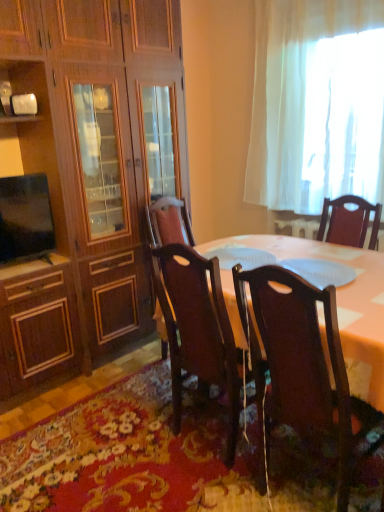
The height and width of the screenshot is (512, 384). What do you see at coordinates (197, 329) in the screenshot?
I see `polished dark wood chair at center, the 1th chair viewed from the left` at bounding box center [197, 329].

The image size is (384, 512). Describe the element at coordinates (25, 218) in the screenshot. I see `matte black tv at left` at that location.

What do you see at coordinates (317, 104) in the screenshot? Image resolution: width=384 pixels, height=512 pixels. I see `white sheer curtain at upper right` at bounding box center [317, 104].

The height and width of the screenshot is (512, 384). Describe the element at coordinates (304, 367) in the screenshot. I see `dark wood chair at lower right, arranged as the 1th chair when viewed from the right` at that location.

Locate an element on the screen. This screenshot has height=512, width=384. polished dark wood chair at center, the 2th chair in the right-to-left sequence is located at coordinates (197, 329).

Considering the relative sizes of matte black tv at left and polished dark wood chair at center, the 2th chair in the right-to-left sequence, in the image provided, is matte black tv at left thinner than polished dark wood chair at center, the 2th chair in the right-to-left sequence,?

Correct, the width of matte black tv at left is less than that of polished dark wood chair at center, the 2th chair in the right-to-left sequence.

From the picture: Who is smaller, matte black tv at left or polished dark wood chair at center, the 2th chair in the right-to-left sequence?

matte black tv at left.

Between matte black tv at left and polished dark wood chair at center, the 1th chair viewed from the left, which one is positioned in front?

polished dark wood chair at center, the 1th chair viewed from the left, is more forward.

Looking at this image, how many degrees apart are the facing directions of matte black tv at left and polished dark wood chair at center, the 2th chair in the right-to-left sequence?

There is a 93.4-degree angle between the facing directions of matte black tv at left and polished dark wood chair at center, the 2th chair in the right-to-left sequence.

From the image's perspective, is white sheer curtain at upper right located above or below dark wood chair at lower right, arranged as the 1th chair when viewed from the right?

From the image's perspective, white sheer curtain at upper right appears above dark wood chair at lower right, arranged as the 1th chair when viewed from the right.

Is white sheer curtain at upper right positioned beyond the bounds of dark wood chair at lower right, the second chair positioned from the left?

Indeed, white sheer curtain at upper right is completely outside dark wood chair at lower right, the second chair positioned from the left.

Considering the relative sizes of white sheer curtain at upper right and dark wood chair at lower right, arranged as the 1th chair when viewed from the right, in the image provided, is white sheer curtain at upper right taller than dark wood chair at lower right, arranged as the 1th chair when viewed from the right,?

Correct, white sheer curtain at upper right is much taller as dark wood chair at lower right, arranged as the 1th chair when viewed from the right.

Considering the sizes of objects floral carpet at lower center and white sheer curtain at upper right in the image provided, who is bigger, floral carpet at lower center or white sheer curtain at upper right?

Bigger between the two is white sheer curtain at upper right.

Is floral carpet at lower center taller than white sheer curtain at upper right?

No, floral carpet at lower center is not taller than white sheer curtain at upper right.

Which object is more forward, floral carpet at lower center or white sheer curtain at upper right?

floral carpet at lower center.

Would you say floral carpet at lower center is to the left or to the right of white sheer curtain at upper right in the picture?

floral carpet at lower center is positioned on white sheer curtain at upper right's left side.

The height and width of the screenshot is (512, 384). Identify the location of cabinetry lying behind the polished dark wood chair at center, the 1th chair viewed from the left. (89, 173).

Is wooden cabinet at left wider than polished dark wood chair at center, the 1th chair viewed from the left?

Indeed, wooden cabinet at left has a greater width compared to polished dark wood chair at center, the 1th chair viewed from the left.

Which object is positioned more to the right, wooden cabinet at left or polished dark wood chair at center, the 1th chair viewed from the left?

From the viewer's perspective, polished dark wood chair at center, the 1th chair viewed from the left, appears more on the right side.

What's the angular difference between wooden cabinet at left and polished dark wood chair at center, the 2th chair in the right-to-left sequence,'s facing directions?

Result: 90 degrees separate the facing orientations of wooden cabinet at left and polished dark wood chair at center, the 2th chair in the right-to-left sequence.

Is point (256, 126) more distant than point (168, 333)?

That is True.

Is white sheer curtain at upper right behind polished dark wood chair at center, the 1th chair viewed from the left?

That is True.

Based on the photo, from the image's perspective, is white sheer curtain at upper right under polished dark wood chair at center, the 1th chair viewed from the left?

No.

Looking at this image, how many degrees apart are the facing directions of white sheer curtain at upper right and polished dark wood chair at center, the 1th chair viewed from the left?

The angular difference between white sheer curtain at upper right and polished dark wood chair at center, the 1th chair viewed from the left, is 180 degrees.

Identify the location of the 1st chair counting from the right of the floral carpet at lower center. (197, 329).

Considering the relative positions of floral carpet at lower center and polished dark wood chair at center, the 1th chair viewed from the left, in the image provided, is floral carpet at lower center to the left of polished dark wood chair at center, the 1th chair viewed from the left, from the viewer's perspective?

Yes, floral carpet at lower center is to the left of polished dark wood chair at center, the 1th chair viewed from the left.

Considering the sizes of floral carpet at lower center and polished dark wood chair at center, the 2th chair in the right-to-left sequence, in the image, is floral carpet at lower center taller or shorter than polished dark wood chair at center, the 2th chair in the right-to-left sequence,?

Considering their sizes, floral carpet at lower center has less height than polished dark wood chair at center, the 2th chair in the right-to-left sequence.

Considering the relative sizes of floral carpet at lower center and polished dark wood chair at center, the 2th chair in the right-to-left sequence, in the image provided, is floral carpet at lower center smaller than polished dark wood chair at center, the 2th chair in the right-to-left sequence,?

Yes.

Is dark wood chair at lower right, arranged as the 1th chair when viewed from the right, aimed at matte black tv at left?

No, dark wood chair at lower right, arranged as the 1th chair when viewed from the right, does not turn towards matte black tv at left.

Relative to matte black tv at left, is dark wood chair at lower right, the second chair positioned from the left, in front or behind?

In the image, dark wood chair at lower right, the second chair positioned from the left, appears in front of matte black tv at left.

From the image's perspective, which is above, dark wood chair at lower right, the second chair positioned from the left, or matte black tv at left?

matte black tv at left is shown above in the image.

The height and width of the screenshot is (512, 384). What are the coordinates of `television above the polished dark wood chair at center, the 1th chair viewed from the left (from a real-world perspective)` in the screenshot? It's located at 25,218.

Identify the location of curtain that is above the dark wood chair at lower right, the second chair positioned from the left (from the image's perspective). The height and width of the screenshot is (512, 384). (317, 104).

Considering their positions, is matte black tv at left positioned further to white sheer curtain at upper right than dark wood chair at lower right, the second chair positioned from the left?

Among the two, matte black tv at left is located further to white sheer curtain at upper right.

Based on their spatial positions, is wooden cabinet at left or floral carpet at lower center further from dark wood chair at lower right, arranged as the 1th chair when viewed from the right?

wooden cabinet at left lies further to dark wood chair at lower right, arranged as the 1th chair when viewed from the right, than the other object.

From the image, which object appears to be farther from white sheer curtain at upper right, wooden cabinet at left or dark wood chair at lower right, arranged as the 1th chair when viewed from the right?

Among the two, dark wood chair at lower right, arranged as the 1th chair when viewed from the right, is located further to white sheer curtain at upper right.

From the image, which object appears to be nearer to polished dark wood chair at center, the 1th chair viewed from the left, white sheer curtain at upper right or dark wood chair at lower right, arranged as the 1th chair when viewed from the right?

The object closer to polished dark wood chair at center, the 1th chair viewed from the left, is dark wood chair at lower right, arranged as the 1th chair when viewed from the right.

Which object lies further to the anchor point dark wood chair at lower right, arranged as the 1th chair when viewed from the right, white sheer curtain at upper right or floral carpet at lower center?

white sheer curtain at upper right is further to dark wood chair at lower right, arranged as the 1th chair when viewed from the right.

Looking at the image, which one is located further to polished dark wood chair at center, the 2th chair in the right-to-left sequence, wooden cabinet at left or dark wood chair at lower right, arranged as the 1th chair when viewed from the right?

wooden cabinet at left is positioned further to the anchor polished dark wood chair at center, the 2th chair in the right-to-left sequence.

Which object lies nearer to the anchor point wooden cabinet at left, white sheer curtain at upper right or dark wood chair at lower right, the second chair positioned from the left?

The object closer to wooden cabinet at left is white sheer curtain at upper right.

When comparing their distances from polished dark wood chair at center, the 2th chair in the right-to-left sequence, does floral carpet at lower center or white sheer curtain at upper right seem closer?

The object closer to polished dark wood chair at center, the 2th chair in the right-to-left sequence, is floral carpet at lower center.

Where is `chair situated between floral carpet at lower center and dark wood chair at lower right, arranged as the 1th chair when viewed from the right, from left to right`? The width and height of the screenshot is (384, 512). chair situated between floral carpet at lower center and dark wood chair at lower right, arranged as the 1th chair when viewed from the right, from left to right is located at coordinates (197, 329).

I want to click on chair located between wooden cabinet at left and dark wood chair at lower right, arranged as the 1th chair when viewed from the right, in the left-right direction, so click(x=197, y=329).

Find the location of `cabinetry that lies between white sheer curtain at upper right and floral carpet at lower center from top to bottom`. cabinetry that lies between white sheer curtain at upper right and floral carpet at lower center from top to bottom is located at coordinates (89, 173).

Where is `chair between matte black tv at left and dark wood chair at lower right, arranged as the 1th chair when viewed from the right`? chair between matte black tv at left and dark wood chair at lower right, arranged as the 1th chair when viewed from the right is located at coordinates [197, 329].